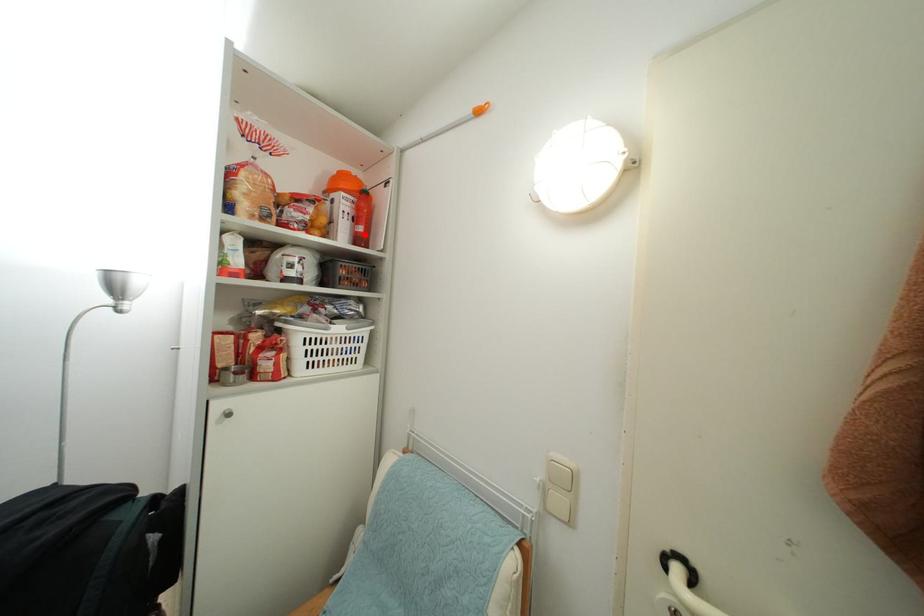
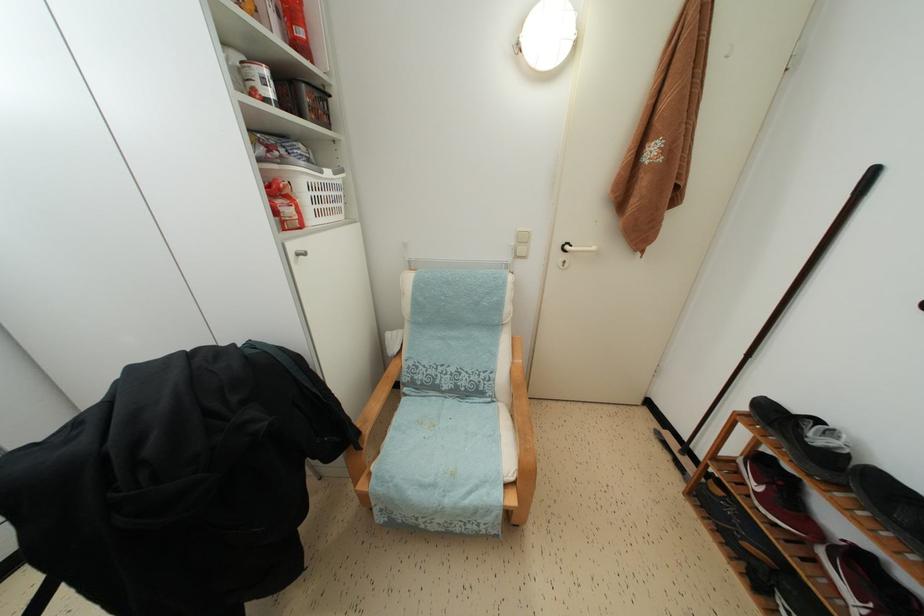
Find the pixel in the second image that matches the highlighted location in the first image.

(305, 38)